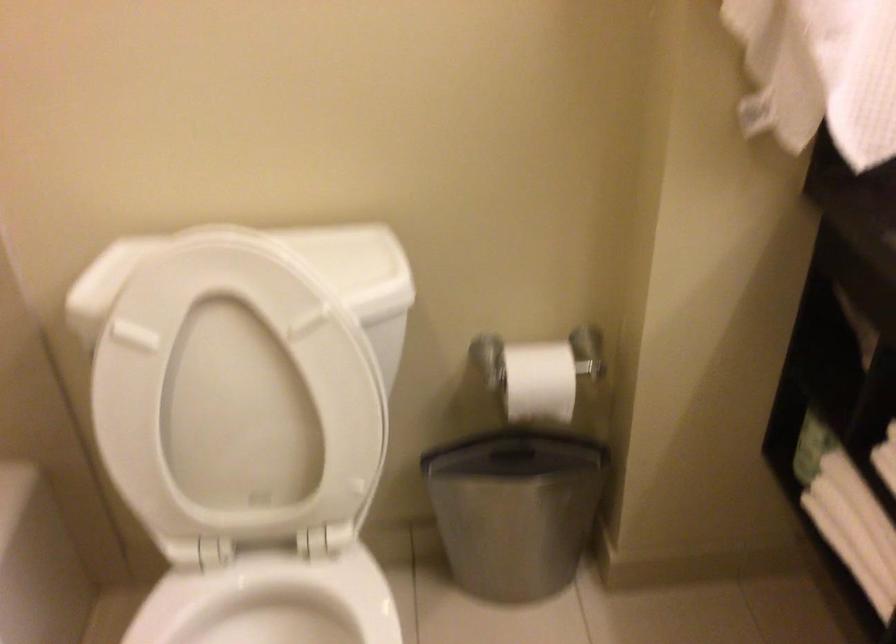
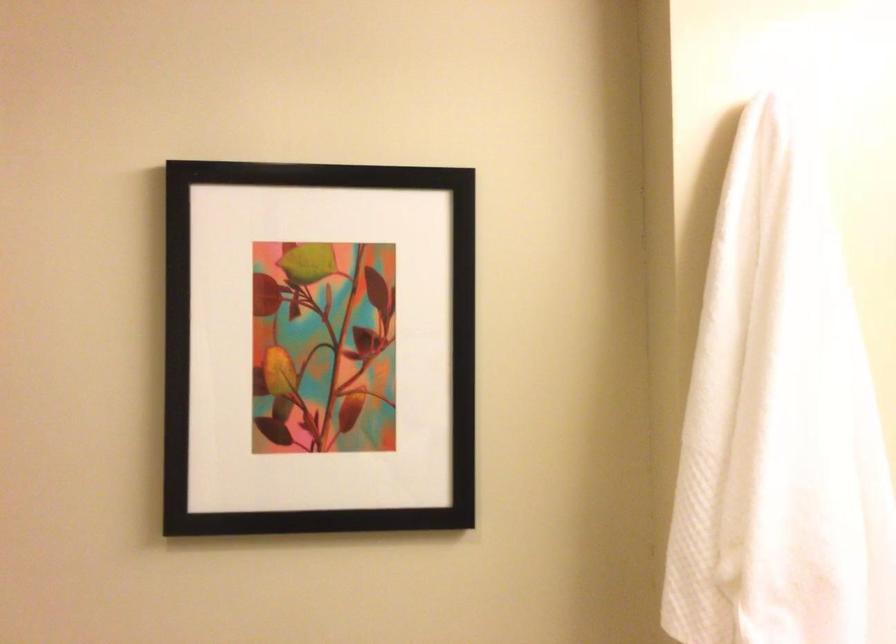
Question: The images are taken continuously from a first-person perspective. In which direction is your viewpoint rotating?

Choices:
 (A) Left
 (B) Right
 (C) Up
 (D) Down

Answer: (C)